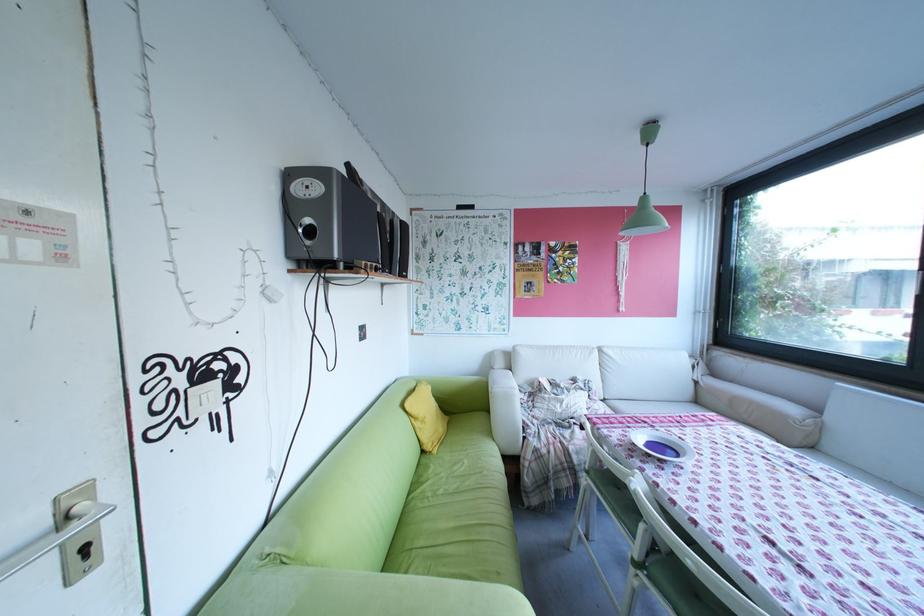
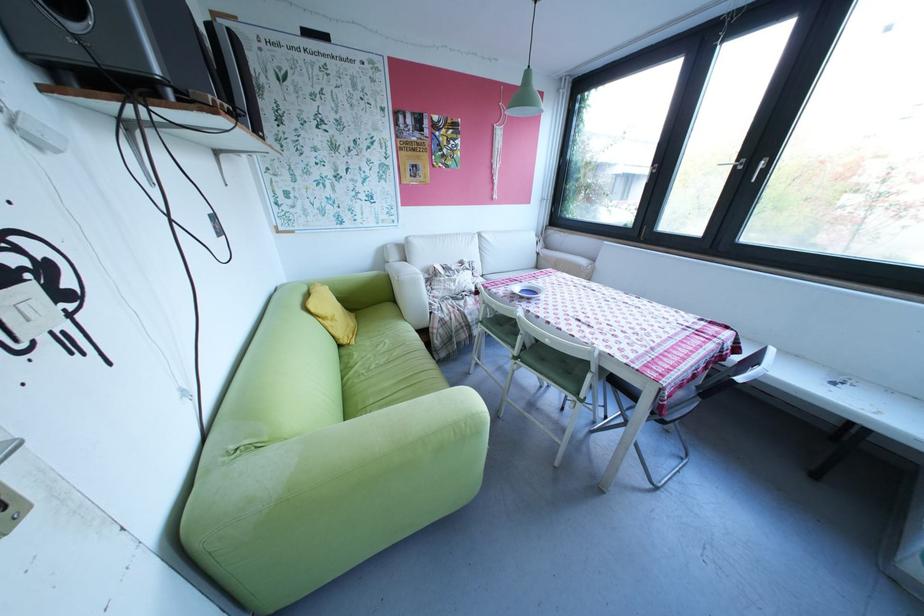
The point at [674,461] is marked in the first image. Where is the corresponding point in the second image?

(541, 299)